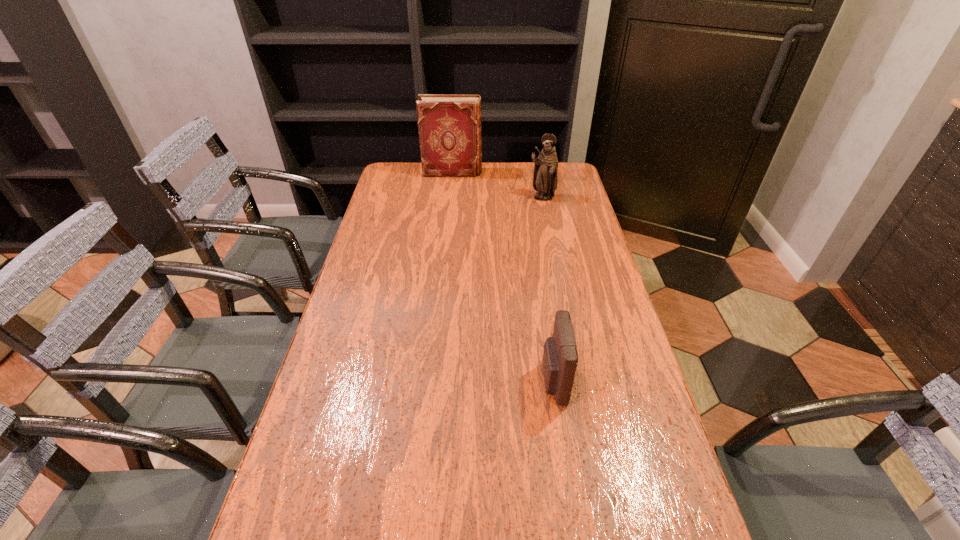
At what (x,y) coordinates should I click in order to perform the action: click on vacant space situated with an open flap on the pouch. Please return your answer as a coordinate pair (x, y). Looking at the image, I should click on (508, 382).

You are a GUI agent. You are given a task and a screenshot of the screen. Output one action in this format:
    pyautogui.click(x=<x>, y=<y>)
    Task: Click on the object positioned at the far edge
    The image size is (960, 540).
    Given the screenshot: What is the action you would take?
    pyautogui.click(x=449, y=126)

This screenshot has width=960, height=540. Identify the location of object present at the left edge. (449, 126).

At what (x,y) coordinates should I click in order to perform the action: click on object located at the right edge. Please return your answer as a coordinate pair (x, y). Image resolution: width=960 pixels, height=540 pixels. Looking at the image, I should click on (545, 179).

This screenshot has height=540, width=960. What are the coordinates of `object at the far left corner` in the screenshot? It's located at (449, 126).

Identify the location of blank space at the far edge of the desktop. (511, 162).

In the image, there is a desktop. Where is `vacant space at the left edge`? The width and height of the screenshot is (960, 540). vacant space at the left edge is located at coordinates [361, 280].

This screenshot has width=960, height=540. I want to click on vacant space at the right edge of the desktop, so click(x=612, y=338).

I want to click on free space at the far left corner of the desktop, so click(x=404, y=177).

Image resolution: width=960 pixels, height=540 pixels. What are the coordinates of `free spot between the second nearest object and the nearest object` in the screenshot? It's located at (547, 290).